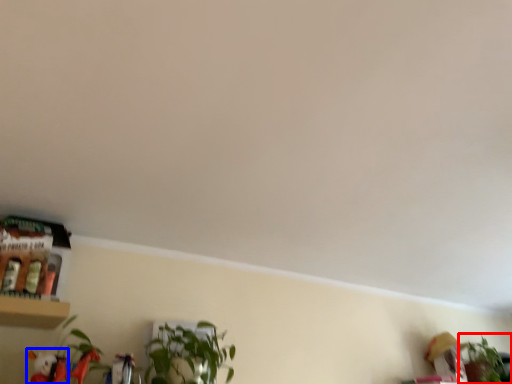
Question: Which point is closer to the camera, houseplant (highlighted by a red box) or toy (highlighted by a blue box)?

Choices:
 (A) houseplant
 (B) toy

Answer: (B)